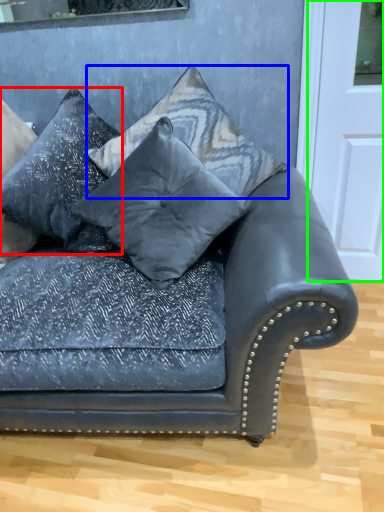
Question: Which object is positioned closest to pillow (highlighted by a red box)? Select from pillow (highlighted by a blue box) and door (highlighted by a green box).

Choices:
 (A) pillow
 (B) door

Answer: (A)